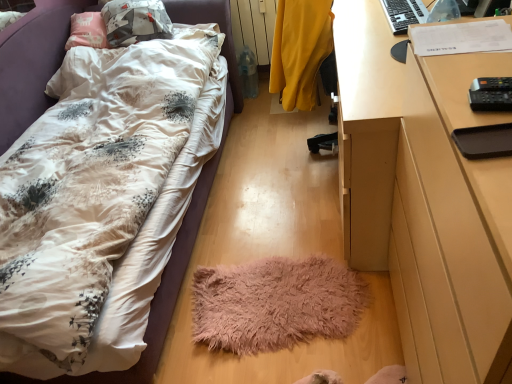
Question: Looking at their shapes, would you say yellow matte radiator at upper center is wider or thinner than black plastic keyboard at upper right?

Choices:
 (A) thin
 (B) wide

Answer: (B)

Question: Is yellow matte radiator at upper center taller or shorter than black plastic keyboard at upper right?

Choices:
 (A) tall
 (B) short

Answer: (A)

Question: Which object is positioned farthest from the black plastic keyboard at upper right?

Choices:
 (A) yellow fabric chair at center
 (B) black plastic remote control at right
 (C) black matte tray at right
 (D) fuzzy pink mat at center
 (E) yellow matte radiator at upper center

Answer: (E)

Question: Considering the real-world distances, which object is farthest from the yellow fabric chair at center?

Choices:
 (A) black matte tray at right
 (B) black plastic remote control at right
 (C) black plastic keyboard at upper right
 (D) yellow matte radiator at upper center
 (E) fluffy white bed at lower left

Answer: (A)